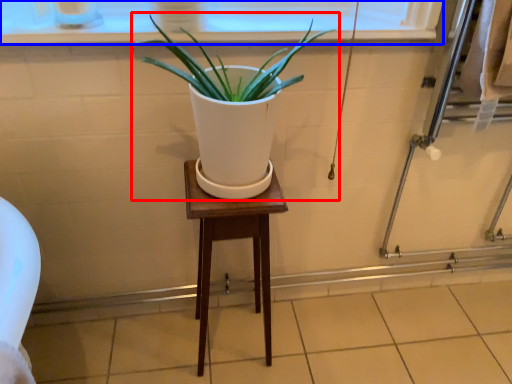
Question: Among these objects, which one is farthest to the camera, houseplant (highlighted by a red box) or window frame (highlighted by a blue box)?

Choices:
 (A) houseplant
 (B) window frame

Answer: (B)